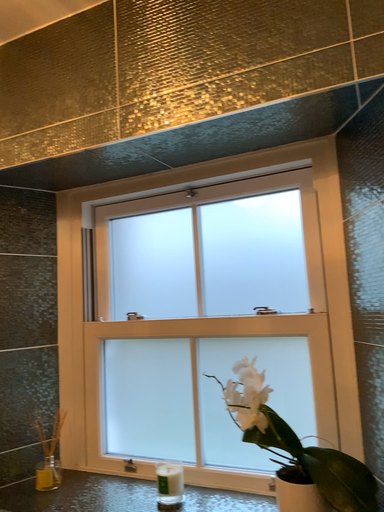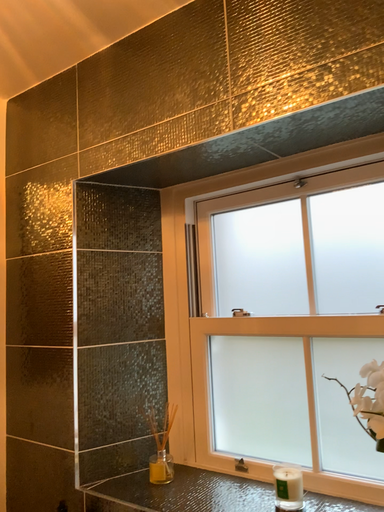
Question: Which way did the camera rotate in the video?

Choices:
 (A) rotated right
 (B) rotated left

Answer: (B)